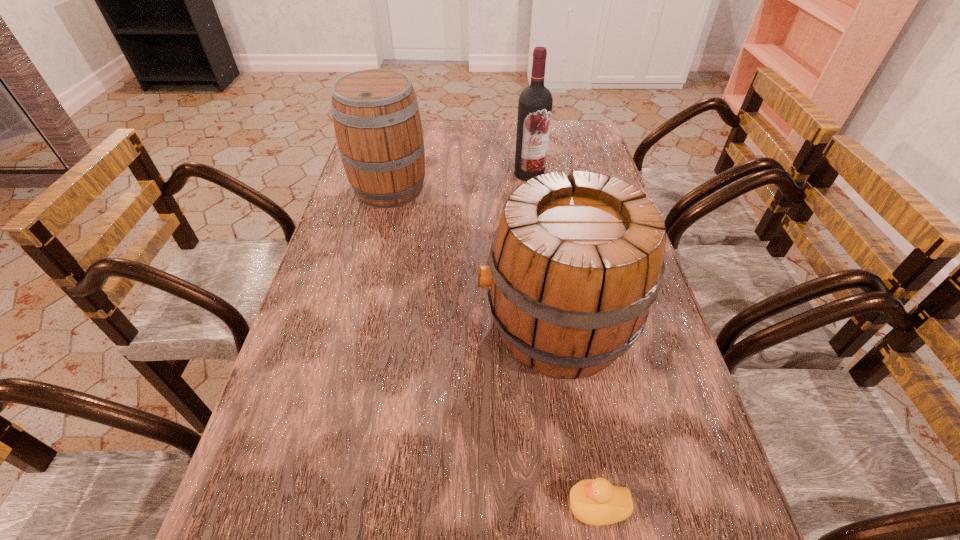
Locate an element on the screen. The width and height of the screenshot is (960, 540). wine bottle is located at coordinates (535, 103).

Find the location of a particular element. the farther cider is located at coordinates (377, 123).

Locate an element on the screen. This screenshot has width=960, height=540. the left cider is located at coordinates (377, 123).

Find the location of a particular element. The height and width of the screenshot is (540, 960). the third farthest object is located at coordinates (574, 265).

The width and height of the screenshot is (960, 540). I want to click on the nearer cider, so click(574, 265).

Locate an element on the screen. the nearest object is located at coordinates (596, 502).

You are a GUI agent. You are given a task and a screenshot of the screen. Output one action in this format:
    pyautogui.click(x=<x>, y=<y>)
    Task: Click on the duck
    This screenshot has height=540, width=960.
    Given the screenshot: What is the action you would take?
    pos(596,502)

The height and width of the screenshot is (540, 960). I want to click on vacant space located 0.210m on the label of the wine bottle, so click(x=537, y=225).

This screenshot has height=540, width=960. I want to click on vacant space positioned on the front of the leftmost object, so click(x=363, y=298).

At what (x,y) coordinates should I click in order to perform the action: click on free location located 0.200m on the side of the third farthest object where the spigot is located. Please return your answer as a coordinate pair (x, y). Looking at the image, I should click on (389, 326).